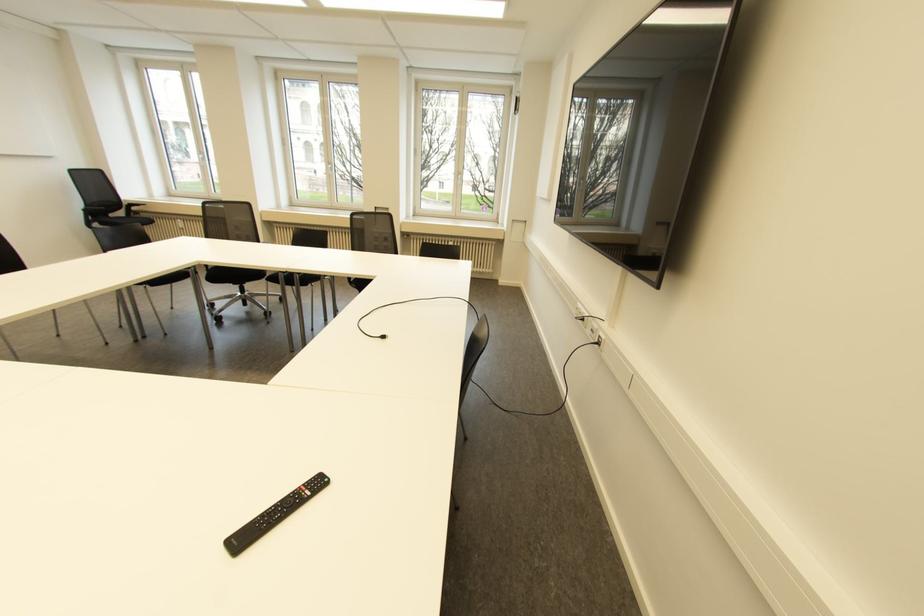
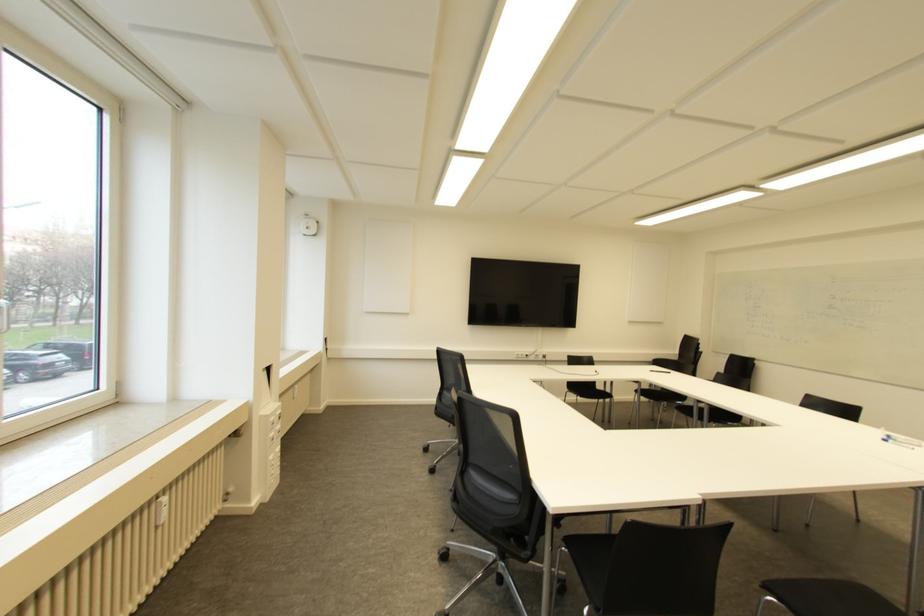
Locate, in the second image, the point that corresponds to point 598,342 in the first image.

(543, 355)